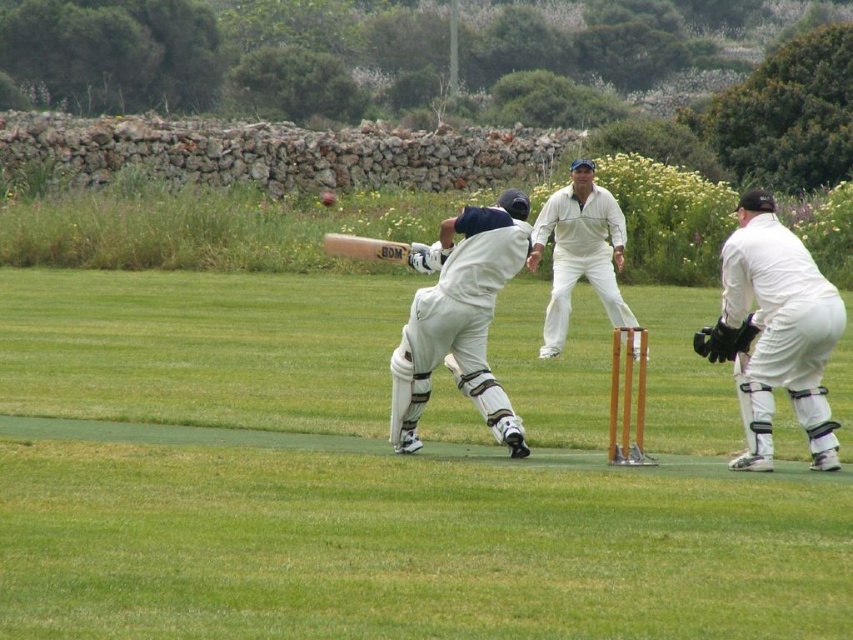
You are a fielder positioned at the point marked as point (405, 436). The ball is hit towards you, but it will land 35.30 feet away from your current position. Can you catch it without moving from your spot?

The distance between you and the ball landing spot is 35.30 feet. Since the ball will land 35.30 feet away from your position at point (405, 436), you cannot reach it without moving.

You are a photographer standing at the edge of the cricket field. You want to take a photo that includes both the point at coordinates point (804, 276) and point (633, 323). Which point should you focus on first to ensure both are in sharp focus?

You should focus on point (804, 276) first because it is closer to the viewer than point (633, 323). This ensures the closer point is in focus, and the farther point will also be sharp due to depth of field.